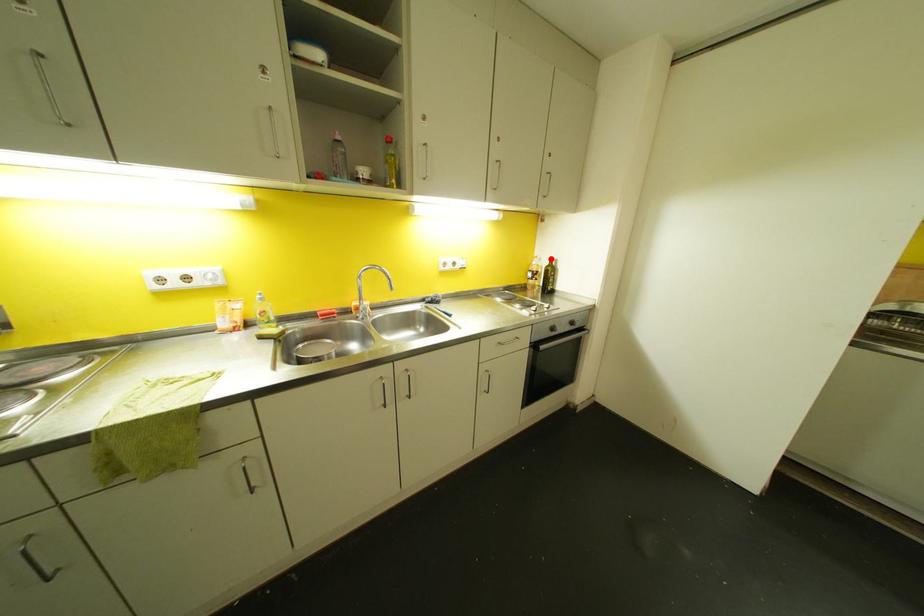
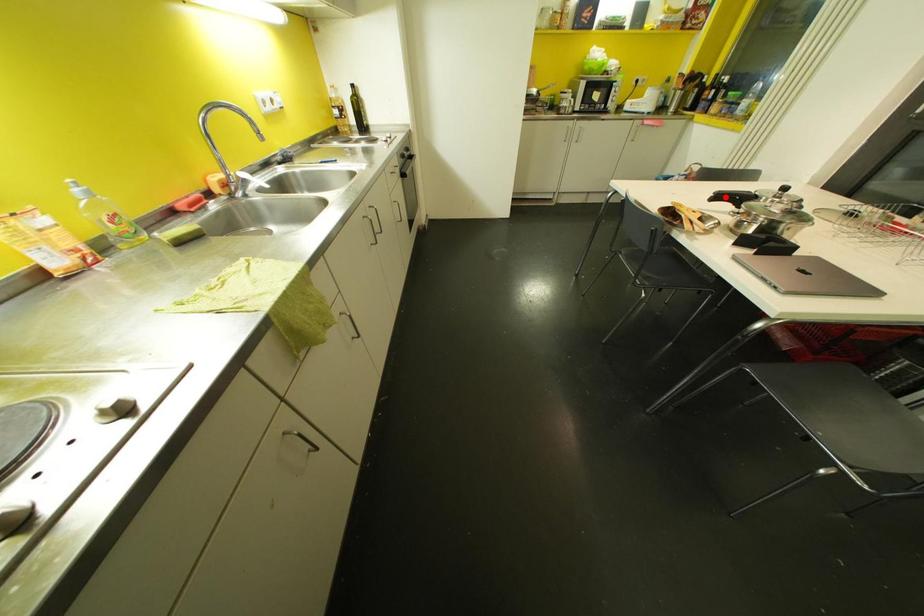
I am providing you with two images of the same scene from different viewpoints. A red point is marked on the first image and another point is marked on the second image. Does the point marked in image1 correspond to the same location as the one in image2?

No